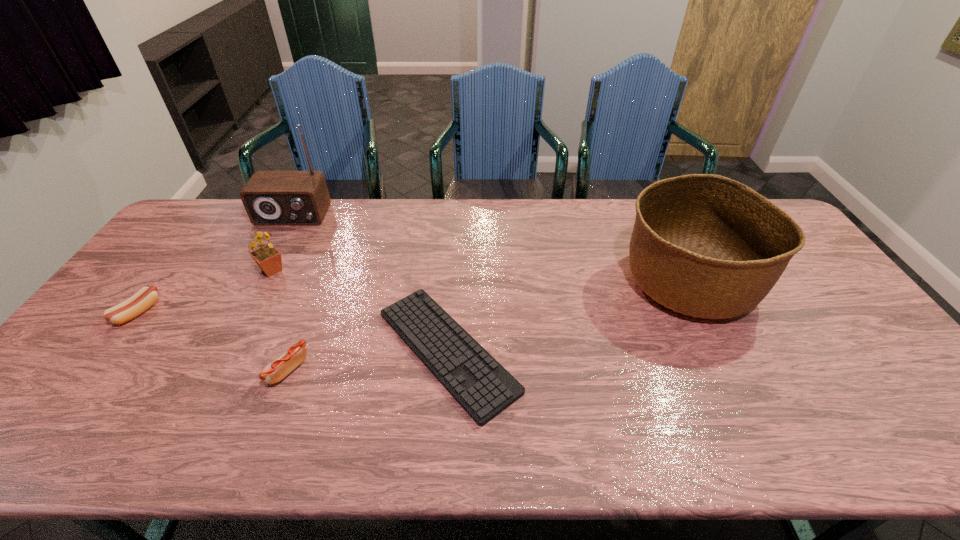
In order to click on vacant space that satisfies the following two spatial constraints: 1. at the front of the fourth shortest object with flowers visible; 2. on the back side of the shortest object in this screenshot , I will do `click(230, 351)`.

Find the location of `vacant space that satisfies the following two spatial constraints: 1. on the back side of the right sausage; 2. on the left side of the computer keyboard`. vacant space that satisfies the following two spatial constraints: 1. on the back side of the right sausage; 2. on the left side of the computer keyboard is located at coordinates click(x=295, y=351).

At what (x,y) coordinates should I click in order to perform the action: click on free space that satisfies the following two spatial constraints: 1. on the front-facing side of the farthest object; 2. on the left side of the rightmost object. Please return your answer as a coordinate pair (x, y). Looking at the image, I should click on (257, 282).

This screenshot has width=960, height=540. In order to click on vacant space that satisfies the following two spatial constraints: 1. at the front of the fourth shortest object with flowers visible; 2. on the back side of the second tallest object in this screenshot , I will do `click(266, 282)`.